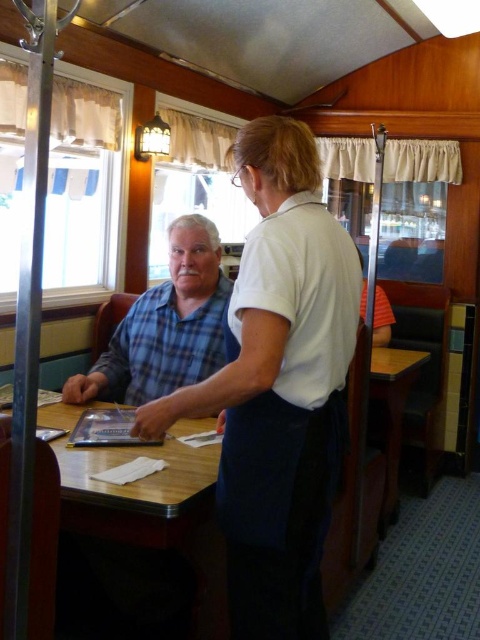
Identify the location of wooden table at center. (156, 509).

Which is above, wooden table at center or blue plaid shirt at left?

blue plaid shirt at left is higher up.

Is point (160, 541) positioned in front of point (159, 301)?

Yes, it is in front of point (159, 301).

Is point (194, 529) farther from camera compared to point (144, 305)?

No.

The height and width of the screenshot is (640, 480). I want to click on wooden table at center, so click(156, 509).

Between point (275, 534) and point (393, 468), which one is positioned behind?

Positioned behind is point (393, 468).

Is white cotton shirt at center to the left of wooden table at lower right from the viewer's perspective?

Yes, white cotton shirt at center is to the left of wooden table at lower right.

Does point (314, 451) come behind point (393, 465)?

No, (314, 451) is closer to viewer.

Where is `white cotton shirt at center`? The width and height of the screenshot is (480, 640). white cotton shirt at center is located at coordinates (278, 387).